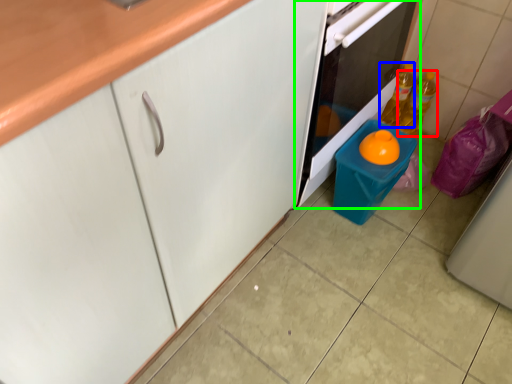
Question: Based on their relative distances, which object is farther from bottle (highlighted by a red box)? Choose from bottle (highlighted by a blue box) and home appliance (highlighted by a green box).

Choices:
 (A) bottle
 (B) home appliance

Answer: (B)